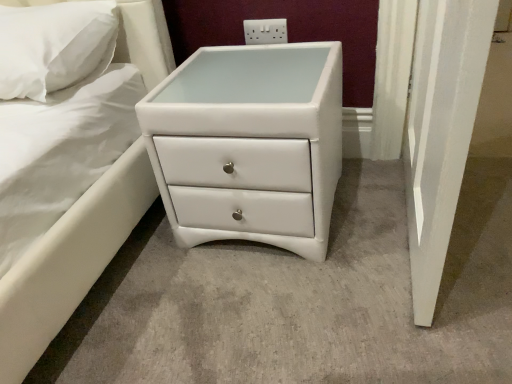
You are a GUI agent. You are given a task and a screenshot of the screen. Output one action in this format:
    pyautogui.click(x=<x>, y=<y>)
    Task: Click on the white leather chest of drawers at center
    
    Given the screenshot: What is the action you would take?
    click(x=249, y=144)

This screenshot has height=384, width=512. I want to click on white leather chest of drawers at center, so click(249, 144).

How many degrees apart are the facing directions of white plastic electric outlet at upper center and white soft pillow at upper left?

1.69 degrees separate the facing orientations of white plastic electric outlet at upper center and white soft pillow at upper left.

Considering the relative positions of white plastic electric outlet at upper center and white soft pillow at upper left in the image provided, is white plastic electric outlet at upper center to the left or to the right of white soft pillow at upper left?

Based on their positions, white plastic electric outlet at upper center is located to the right of white soft pillow at upper left.

Is white plastic electric outlet at upper center facing away from white soft pillow at upper left?

No, white plastic electric outlet at upper center is not facing the opposite direction of white soft pillow at upper left.

Would you say white plastic electric outlet at upper center is inside or outside white soft pillow at upper left?

white plastic electric outlet at upper center is outside white soft pillow at upper left.

Which is closer, (286, 21) or (297, 226)?

The point (297, 226) is in front.

From the picture: From the image's perspective, would you say white plastic electric outlet at upper center is positioned over white leather chest of drawers at center?

Indeed, from the image's perspective, white plastic electric outlet at upper center is shown above white leather chest of drawers at center.

Measure the distance between white leather chest of drawers at center and white soft pillow at upper left.

white leather chest of drawers at center and white soft pillow at upper left are 16.98 inches apart.

Is white leather chest of drawers at center aimed at white soft pillow at upper left?

No, white leather chest of drawers at center does not turn towards white soft pillow at upper left.

Consider the image. Is the position of white leather chest of drawers at center more distant than that of white soft pillow at upper left?

No, white leather chest of drawers at center is closer to the camera.

You are a GUI agent. You are given a task and a screenshot of the screen. Output one action in this format:
    pyautogui.click(x=<x>, y=<y>)
    Task: Click on the pillow above the white leather chest of drawers at center (from the image's perspective)
    Image resolution: width=512 pixels, height=384 pixels.
    Given the screenshot: What is the action you would take?
    pyautogui.click(x=51, y=46)

Based on the photo, is white soft pillow at upper left turned away from white leather chest of drawers at center?

That's not correct — white soft pillow at upper left is not looking away from white leather chest of drawers at center.

From the picture: Does white soft pillow at upper left have a greater width compared to white leather chest of drawers at center?

No.

Which object is positioned more to the right, white soft pillow at upper left or white leather chest of drawers at center?

From the viewer's perspective, white leather chest of drawers at center appears more on the right side.

Does point (88, 47) appear closer or farther from the camera than point (289, 50)?

Point (88, 47) is closer to the camera than point (289, 50).

Find the location of `electric outlet located behind the white soft pillow at upper left`. electric outlet located behind the white soft pillow at upper left is located at coordinates (265, 31).

From the image's perspective, is white soft pillow at upper left positioned above or below white plastic electric outlet at upper center?

white soft pillow at upper left is below white plastic electric outlet at upper center.

From the picture: Can you tell me how much white soft pillow at upper left and white plastic electric outlet at upper center differ in facing direction?

1.69 degrees.

In the scene shown: Measure the distance between white leather chest of drawers at center and white plastic electric outlet at upper center.

18.45 inches.

Which object is positioned more to the left, white leather chest of drawers at center or white plastic electric outlet at upper center?

Positioned to the left is white leather chest of drawers at center.

Does white leather chest of drawers at center turn towards white plastic electric outlet at upper center?

No, white leather chest of drawers at center does not turn towards white plastic electric outlet at upper center.

Considering their positions, is white leather chest of drawers at center located in front of or behind white plastic electric outlet at upper center?

Visually, white leather chest of drawers at center is located in front of white plastic electric outlet at upper center.

You are a GUI agent. You are given a task and a screenshot of the screen. Output one action in this format:
    pyautogui.click(x=<x>, y=<y>)
    Task: Click on the pillow on the left of white plastic electric outlet at upper center
    
    Given the screenshot: What is the action you would take?
    pyautogui.click(x=51, y=46)

Locate an element on the screen. The image size is (512, 384). chest of drawers below the white plastic electric outlet at upper center (from a real-world perspective) is located at coordinates (249, 144).

Based on their spatial positions, is white leather chest of drawers at center or white soft pillow at upper left further from white plastic electric outlet at upper center?

Among the two, white soft pillow at upper left is located further to white plastic electric outlet at upper center.

From the image, which object appears to be nearer to white plastic electric outlet at upper center, white soft pillow at upper left or white leather chest of drawers at center?

The object closer to white plastic electric outlet at upper center is white leather chest of drawers at center.

Looking at the image, which one is located closer to white soft pillow at upper left, white plastic electric outlet at upper center or white leather chest of drawers at center?

Among the two, white leather chest of drawers at center is located nearer to white soft pillow at upper left.

Based on their spatial positions, is white plastic electric outlet at upper center or white soft pillow at upper left closer to white leather chest of drawers at center?

Among the two, white soft pillow at upper left is located nearer to white leather chest of drawers at center.

Considering their positions, is white leather chest of drawers at center positioned further to white soft pillow at upper left than white plastic electric outlet at upper center?

white plastic electric outlet at upper center is further to white soft pillow at upper left.

Looking at this image, when comparing their distances from white leather chest of drawers at center, does white soft pillow at upper left or white plastic electric outlet at upper center seem closer?

white soft pillow at upper left.

Identify the location of the chest of drawers situated between white soft pillow at upper left and white plastic electric outlet at upper center from left to right. This screenshot has width=512, height=384. click(x=249, y=144).